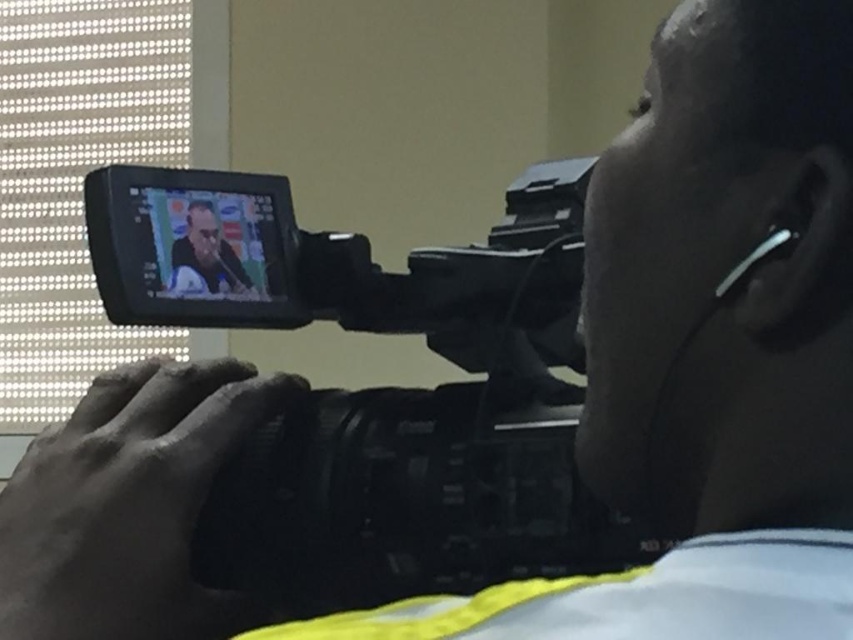
Question: Does black plastic camera at center appear over matte black laptop at center?

Choices:
 (A) yes
 (B) no

Answer: (B)

Question: Does black plastic camera at center appear over matte black laptop at center?

Choices:
 (A) yes
 (B) no

Answer: (B)

Question: Can you confirm if black plastic camera at center is positioned above matte black laptop at center?

Choices:
 (A) yes
 (B) no

Answer: (B)

Question: Which point appears farthest from the camera in this image?

Choices:
 (A) (190, 262)
 (B) (341, 476)

Answer: (B)

Question: Which point is farther to the camera?

Choices:
 (A) (364, 472)
 (B) (227, 288)

Answer: (B)